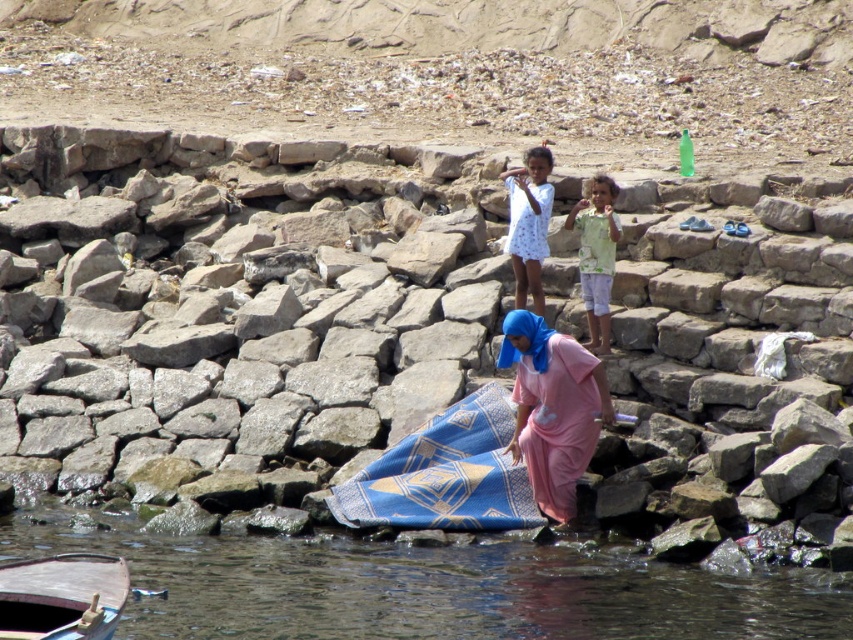
You are a photographer standing at the point marked as point (445, 474) in the image. You want to capture a photo of the blue woven cloth at lower center. Is the blue woven cloth at lower center visible from your current position?

The point (445, 474) corresponds to the blue woven cloth at lower center, so yes, the blue woven cloth at lower center is visible from that position.

You are a photographer standing at the water edge. You want to capture a photo of the blue fabric at center and the light green fabric at upper center. Which fabric will appear larger in the photo?

The blue fabric at center will appear larger in the photo because it is closer to the photographer than the light green fabric at upper center.